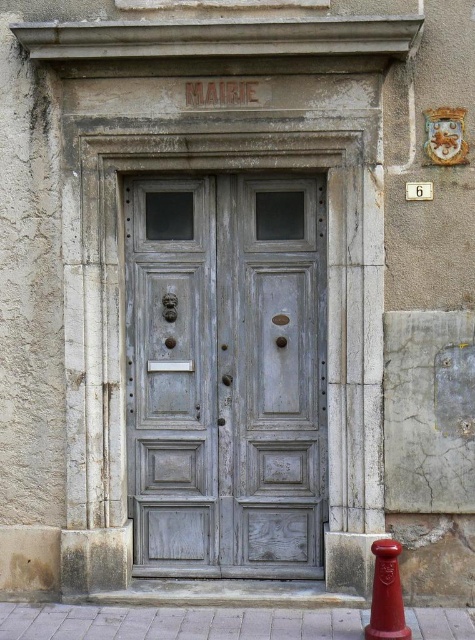
Does weathered wood door at center have a lesser height compared to shiny red traffic cone at lower right?

In fact, weathered wood door at center may be taller than shiny red traffic cone at lower right.

I want to click on weathered wood door at center, so click(226, 374).

Which is in front, point (239, 349) or point (371, 595)?

Point (371, 595)

Locate an element on the screen. The width and height of the screenshot is (475, 640). weathered wood door at center is located at coordinates (226, 374).